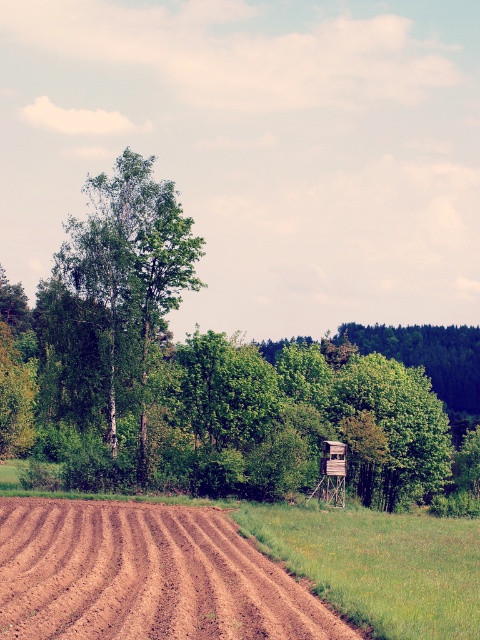
You are a farmer checking the field. You notice the brown soil at lower left and the green leafy tree at center. Which object is positioned lower in the image?

The brown soil at lower left is located below the green leafy tree at center, so it is positioned lower in the image.

You are a farmer checking the field. You see the brown soil at lower left and the green leafy tree at center. Which one is closer to you?

The brown soil at lower left is closer to you because it is in front of the green leafy tree at center.